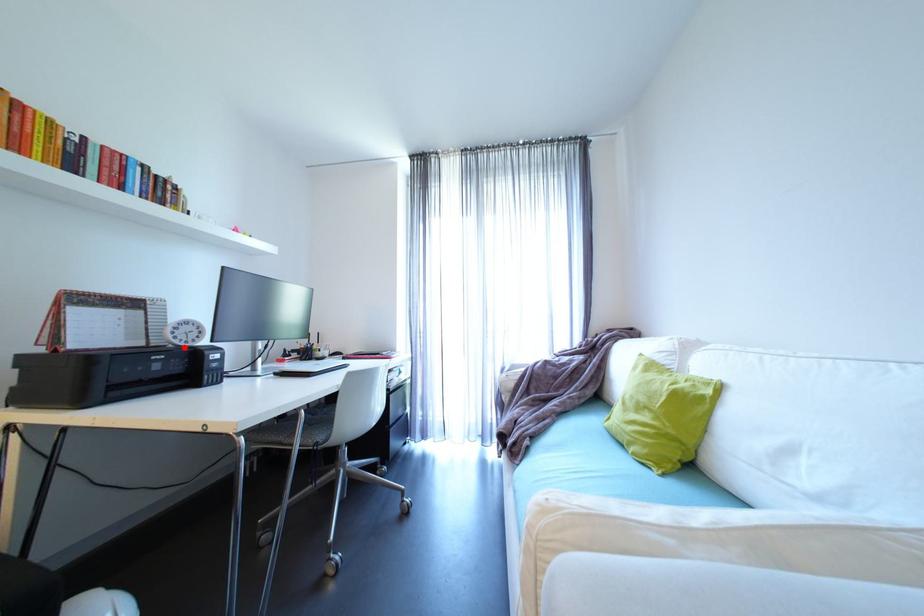
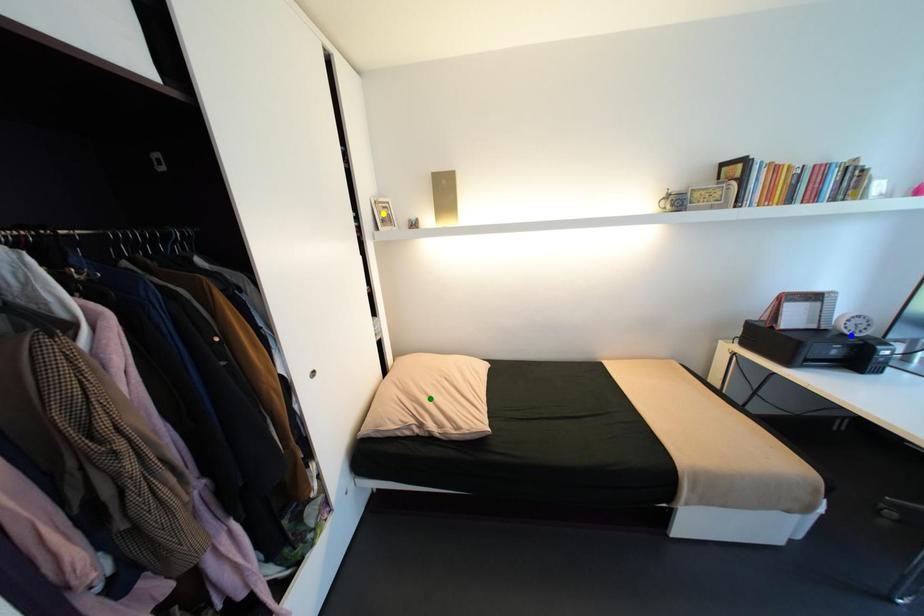
Question: I am providing you with two images of the same scene from different viewpoints. A red point is marked on the first image. You are given multiple points on the second image. Which point in image 2 is actually the same real-world point as the red point in image 1?

Choices:
 (A) green point
 (B) yellow point
 (C) blue point

Answer: (C)